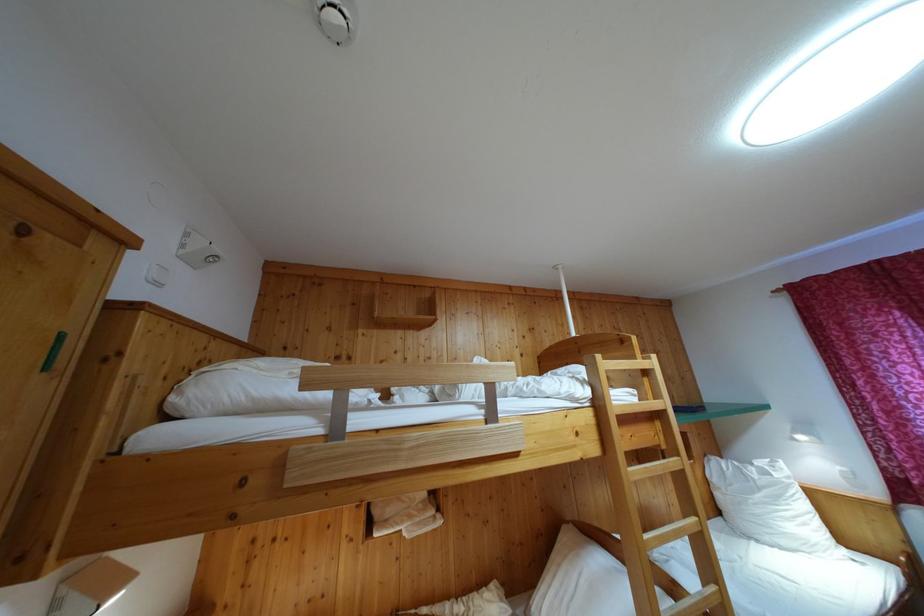
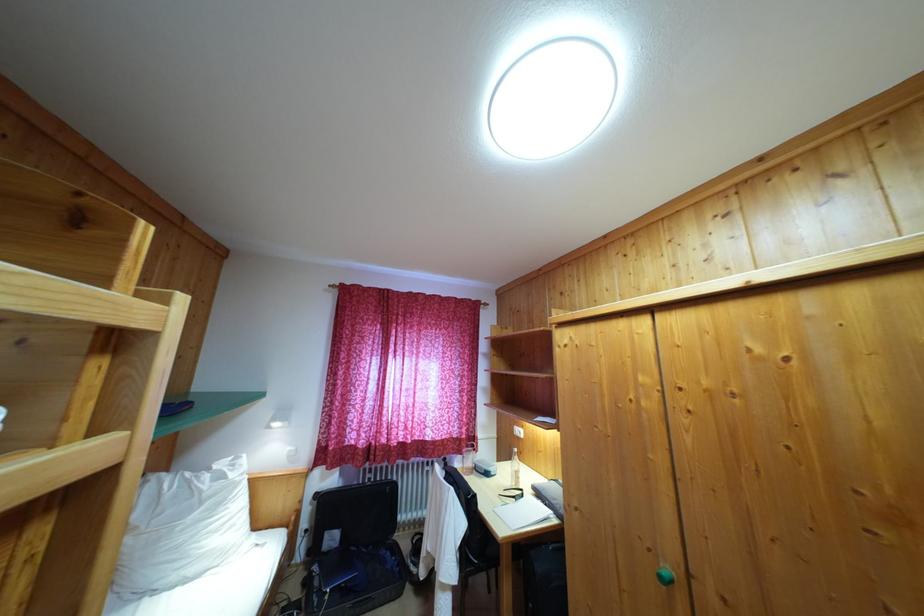
Locate, in the second image, the point that corresponds to point 755,471 in the first image.

(213, 476)